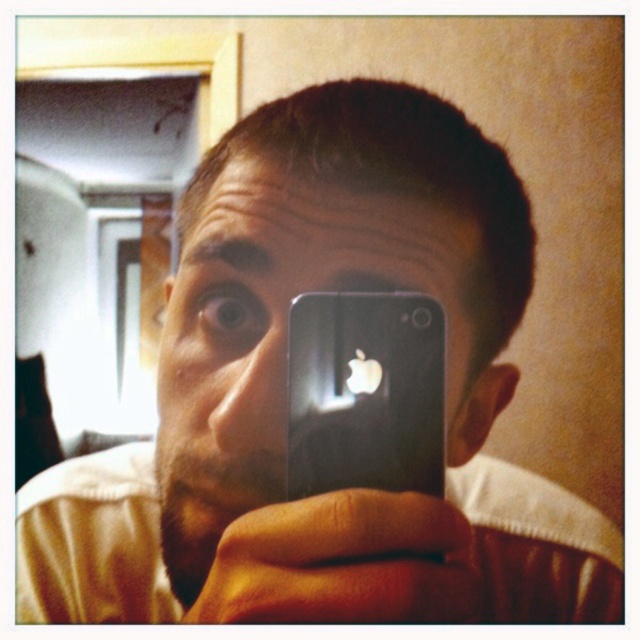
You are trying to decide which phone to take with you on a trip. Both the matte black phone at center and the black matte smartphone at center are in front of you. Which one is taller?

The matte black phone at center is much taller than the black matte smartphone at center.

You are holding a matte black phone at center and want to take a selfie. The recommended safe distance for a clear photo is 8 inches. Is your current distance safe?

The matte black phone at center and viewer are 8.52 inches apart, which is slightly beyond the recommended 8 inches. The distance is still safe for a clear photo, but moving closer to 8 inches would optimize clarity.

You are trying to decide which device to use for taking a quick photo. Both the matte black phone at center and the black matte smartphone at center are available. If you prefer a wider device for easier handling, which one should you choose?

The matte black phone at center is wider than the black matte smartphone at center, so you should choose the matte black phone at center for easier handling due to its larger width.